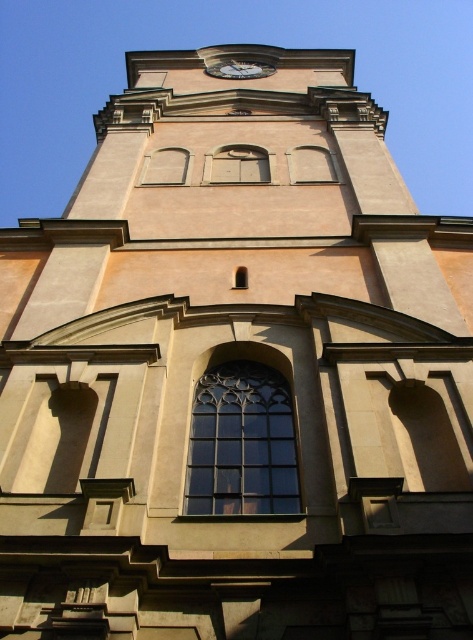
You are an architect evaluating the building facade. You notice two types of windows at the center of the building. The first is a matte glass window at center, and the second is a clear glass window at center. Which one is taller?

The matte glass window at center has a greater height compared to the clear glass window at center, so the matte glass window at center is taller.

Looking at this image, you are an architect evaluating the symmetry of the building facade. You notice two matte glass windows. Which one has a greater width between the matte glass window at center and the matte glass window at upper center?

The matte glass window at center has a greater width than the matte glass window at upper center.